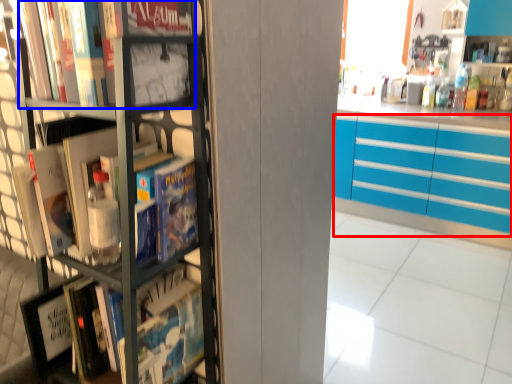
Question: Which point is further to the camera, cabinetry (highlighted by a red box) or book (highlighted by a blue box)?

Choices:
 (A) cabinetry
 (B) book

Answer: (A)